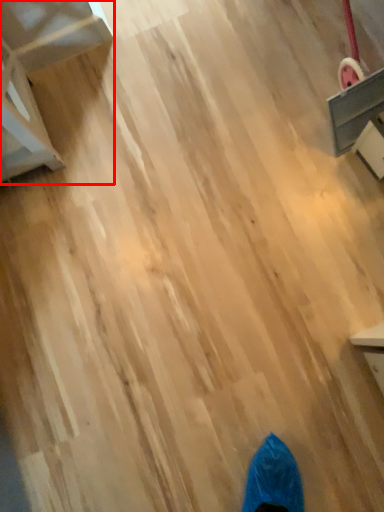
Question: From the image, what is the correct spatial relationship of furniture (annotated by the red box) in relation to furniture?

Choices:
 (A) left
 (B) right

Answer: (A)